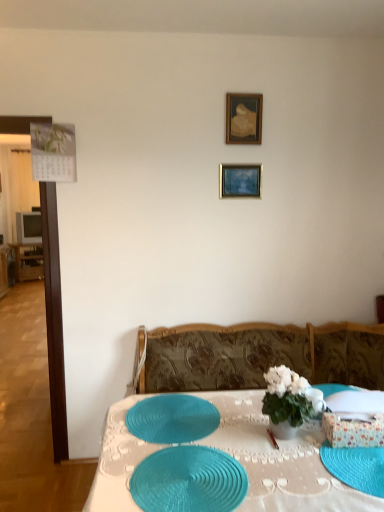
Locate an element on the screen. The height and width of the screenshot is (512, 384). vacant region above teal woven placemat at center, which ranks as the 2th tableware in front-to-back order (from a real-world perspective) is located at coordinates (175, 411).